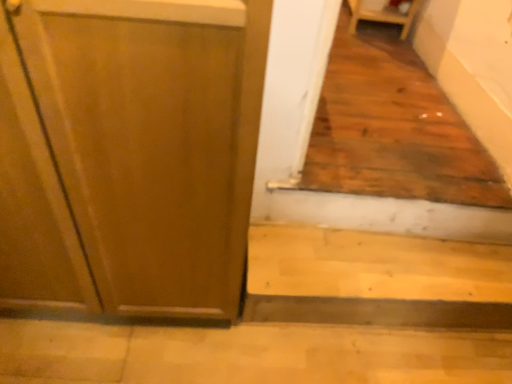
Where is `free point above light wood stair at lower right (from a real-world perspective)`? The image size is (512, 384). free point above light wood stair at lower right (from a real-world perspective) is located at coordinates (359, 266).